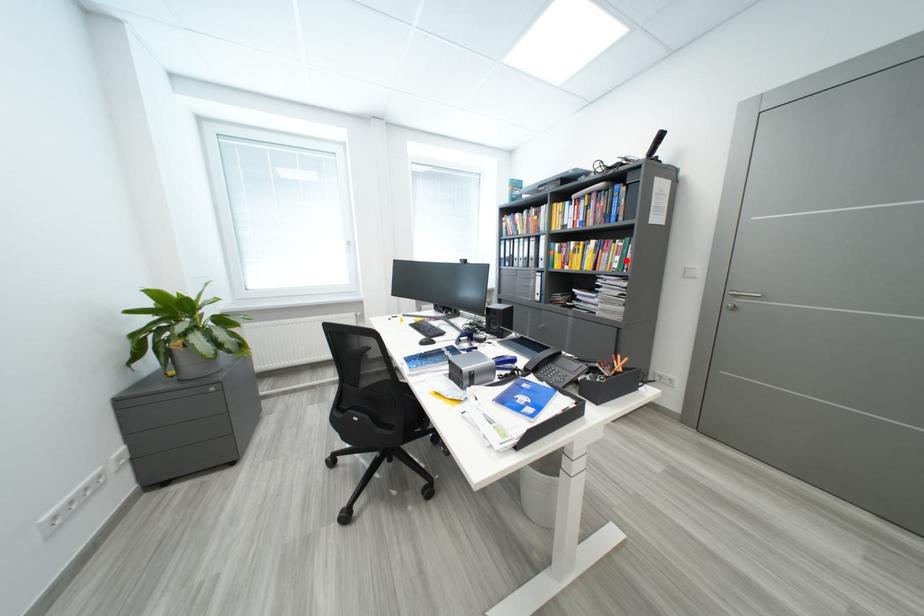
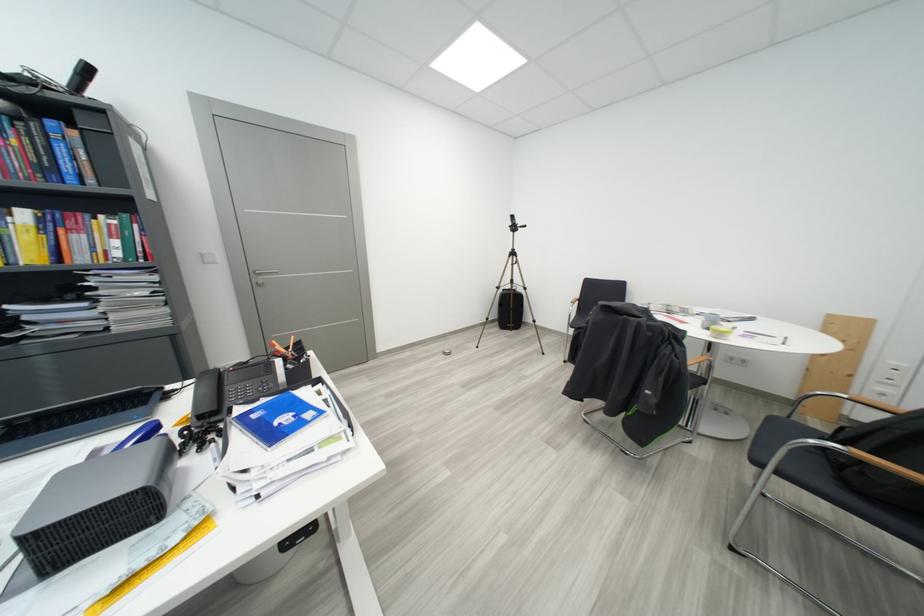
In the second image, find the point that corresponds to the highlighted location in the first image.

(126, 245)